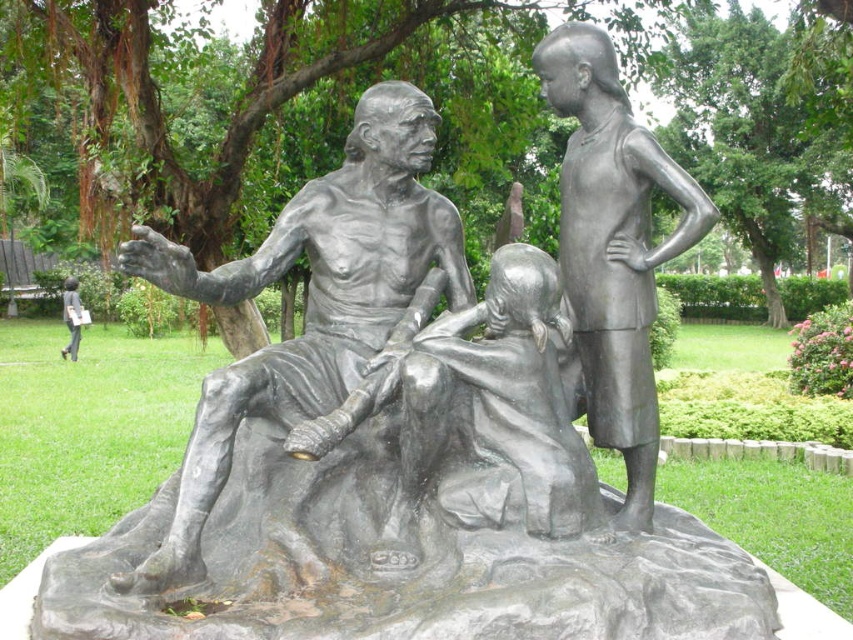
Is point (599, 323) positioned behind point (62, 353)?

No, it is not.

Which of these two, bronze statue of child at center or matte black statue at lower left, stands shorter?

→ Standing shorter between the two is bronze statue of child at center.

Who is more forward, (585, 65) or (76, 292)?

Positioned in front is point (585, 65).

Where is `bronze statue of child at center`? This screenshot has height=640, width=853. bronze statue of child at center is located at coordinates (613, 248).

Is point (413, 330) more distant than point (68, 291)?

No, (413, 330) is closer to viewer.

What do you see at coordinates (312, 304) in the screenshot? I see `bronze statue of man at center` at bounding box center [312, 304].

Which is behind, point (430, 216) or point (67, 323)?

Point (67, 323)

This screenshot has height=640, width=853. Find the location of `bronze statue of man at center`. bronze statue of man at center is located at coordinates (312, 304).

Consider the image. Who is positioned more to the right, bronze statue of man at center or bronze statue of child at center?

Positioned to the right is bronze statue of child at center.

I want to click on bronze statue of man at center, so click(312, 304).

Does point (412, 140) lie in front of point (605, 316)?

That is False.

At what (x,y) coordinates should I click in order to perform the action: click on bronze statue of man at center. Please return your answer as a coordinate pair (x, y). Looking at the image, I should click on (312, 304).